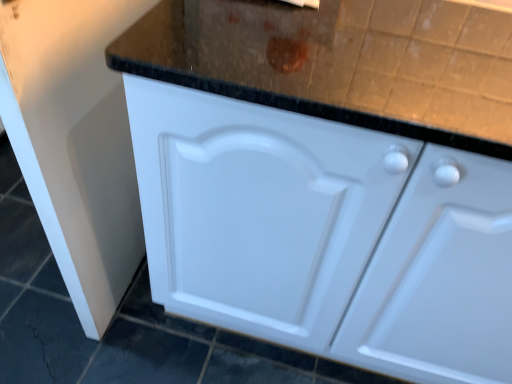
The height and width of the screenshot is (384, 512). What are the coordinates of `white glossy cabinet at center` in the screenshot? It's located at (326, 235).

What is the approximate width of white glossy cabinet at center?

white glossy cabinet at center is 5.96 feet in width.

The height and width of the screenshot is (384, 512). What do you see at coordinates (326, 235) in the screenshot?
I see `white glossy cabinet at center` at bounding box center [326, 235].

Where is `white glossy cabinet at center`? Image resolution: width=512 pixels, height=384 pixels. white glossy cabinet at center is located at coordinates (326, 235).